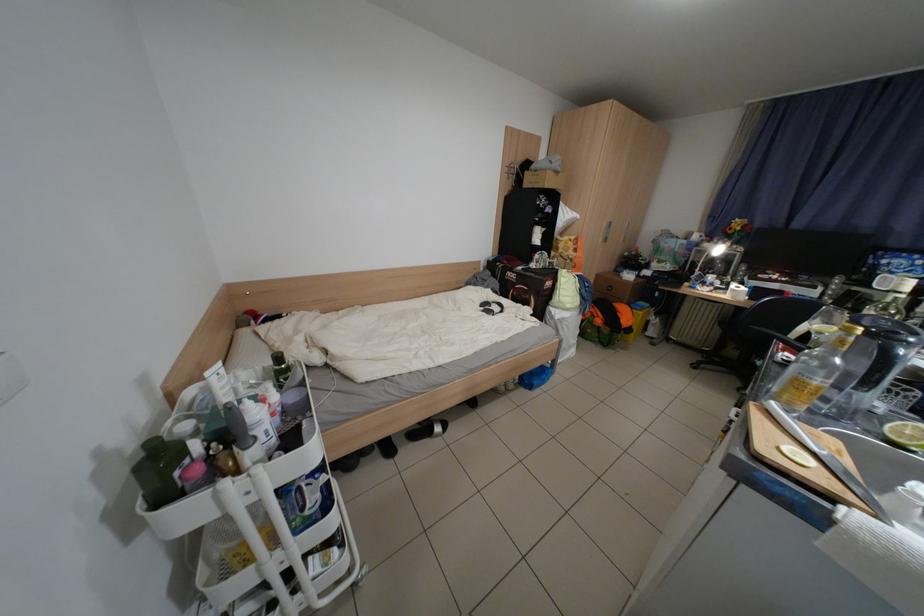
Where is `cut lime half`? The image size is (924, 616). cut lime half is located at coordinates (905, 435).